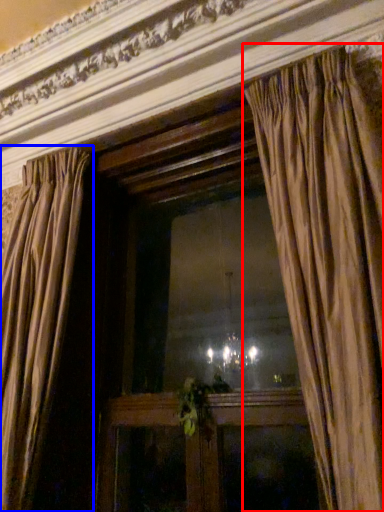
Question: Which point is closer to the camera, curtain (highlighted by a red box) or curtain (highlighted by a blue box)?

Choices:
 (A) curtain
 (B) curtain

Answer: (A)